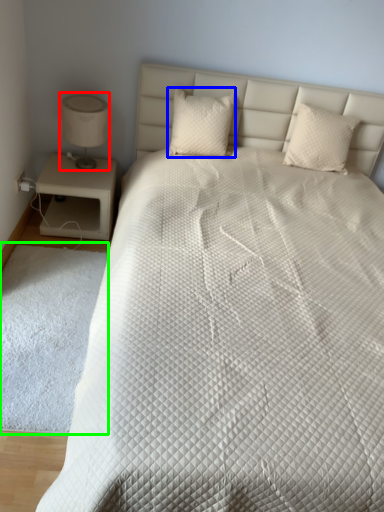
Question: Which is farther away from table lamp (highlighted by a red box)? pillow (highlighted by a blue box) or mat (highlighted by a green box)?

Choices:
 (A) pillow
 (B) mat

Answer: (B)